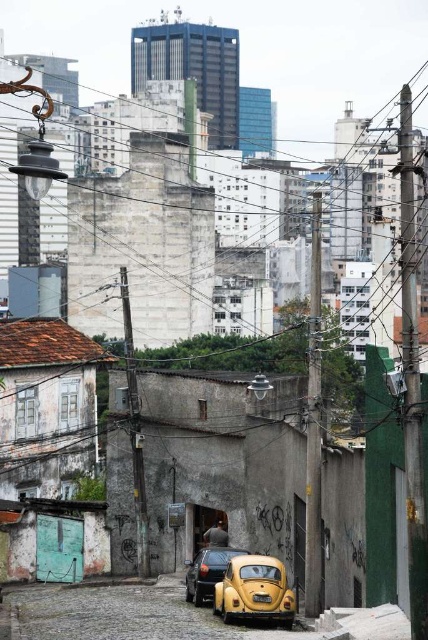
Between yellow matte car at lower center and yellow matte car at center, which one is positioned higher?

yellow matte car at lower center is above.

Is point (261, 582) less distant than point (202, 577)?

Yes.

You are a GUI agent. You are given a task and a screenshot of the screen. Output one action in this format:
    pyautogui.click(x=<x>, y=<y>)
    Task: Click on the yellow matte car at lower center
    
    Given the screenshot: What is the action you would take?
    pyautogui.click(x=253, y=589)

Can you confirm if yellow matte car at center is thinner than yellow matte license plate at center?

No.

Between yellow matte car at center and yellow matte license plate at center, which one is positioned higher?

yellow matte license plate at center is above.

Between point (246, 554) and point (258, 600), which one is positioned in front?

Point (258, 600)

At what (x,y) coordinates should I click in order to perform the action: click on yellow matte car at center. Please return your answer as a coordinate pair (x, y). Looking at the image, I should click on (207, 572).

Does yellow matte car at lower center appear over yellow matte license plate at center?

Incorrect, yellow matte car at lower center is not positioned above yellow matte license plate at center.

Between yellow matte car at lower center and yellow matte license plate at center, which one has more height?

Standing taller between the two is yellow matte car at lower center.

Where is `yellow matte car at lower center`? The height and width of the screenshot is (640, 428). yellow matte car at lower center is located at coordinates [x=253, y=589].